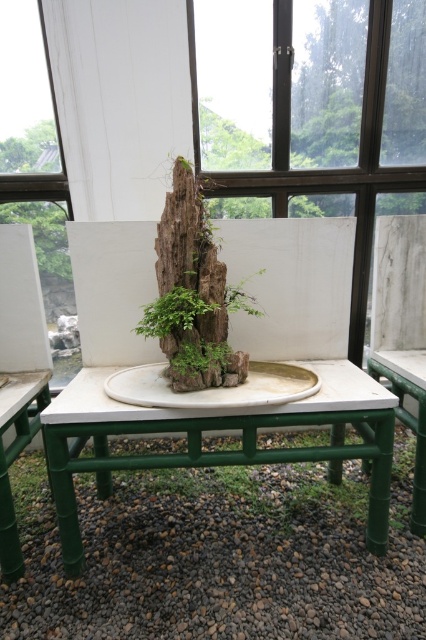
You are an interior designer assessing the layout of the room. You notice the dark brown wood at upper center and the green bamboo table at center. Based on their positions, which object is closer to the left side of the room?

The dark brown wood at upper center is positioned to the left of the green bamboo table at center, so it is closer to the left side of the room.

You are a visitor in the room and want to place a small decorative stone exactly at the point marked as point (218, 429). Is this point located on the white rectangular table with green bamboo legs?

Yes, the point (218, 429) is on the white matte table at center, so it is located on the white rectangular table with green bamboo legs.

You are a delivery person who needs to place a package on the white matte table at center without touching the dark brown wood at upper center. Given that the package is 1.5 meters wide, will it fit between them?

The distance between the dark brown wood at upper center and the white matte table at center is 1.56 meters. Since the package is 1.5 meters wide, it will fit with a small gap remaining.